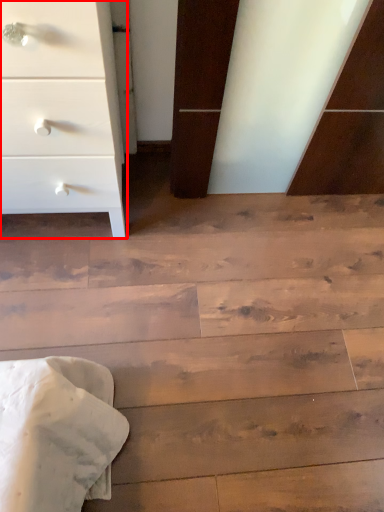
Question: Considering the relative positions of chest of drawers (annotated by the red box) and stairwell in the image provided, where is chest of drawers (annotated by the red box) located with respect to the staircase?

Choices:
 (A) right
 (B) left

Answer: (B)